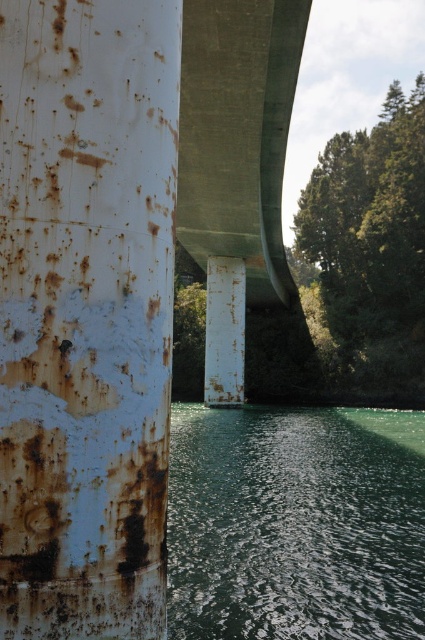
You are a photographer standing at the base of the bridge. You want to capture a shot that includes both the rusty metal pole at left and the green reflective water at lower center. Which object should you position closer to the left edge of your camera frame?

The rusty metal pole at left should be positioned closer to the left edge of your camera frame since it is already located to the left of the green reflective water at lower center.

You are standing on the bridge and want to place a 30 feet long wooden plank between the green reflective water at lower center and the rusty metal pole at center. Can you safely place the plank without it touching the water?

The distance between the green reflective water at lower center and the rusty metal pole at center is 34.32 feet, which is longer than the 30 feet plank. Therefore, the plank can be safely placed without touching the water.